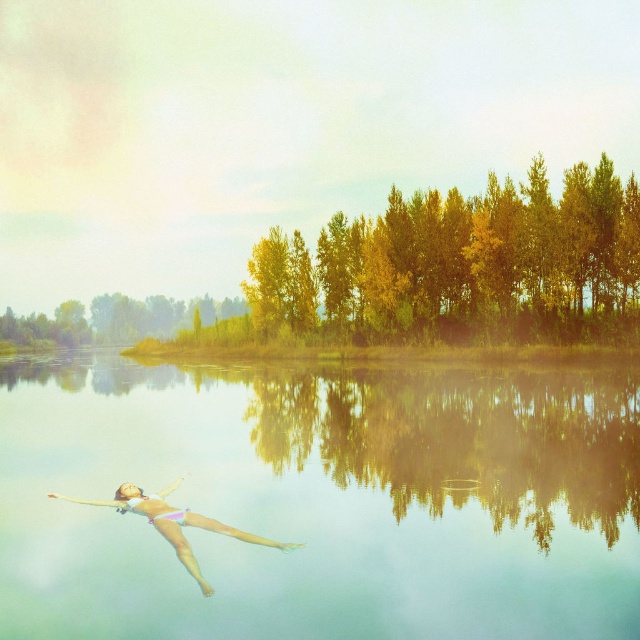
Question: Which point is closer to the camera?

Choices:
 (A) clear water at center
 (B) pink fabric bikini at lower left

Answer: (A)

Question: Does green leafy trees at center have a smaller size compared to pink fabric bikini at lower left?

Choices:
 (A) yes
 (B) no

Answer: (B)

Question: Among these objects, which one is farthest from the camera?

Choices:
 (A) golden textured trees at upper right
 (B) green leafy trees at center
 (C) pink fabric bikini at lower left

Answer: (B)

Question: Which of the following is the closest to the observer?

Choices:
 (A) golden textured trees at upper right
 (B) clear water at center
 (C) pink fabric bikini at lower left

Answer: (B)

Question: Does clear water at center appear under pink fabric bikini at lower left?

Choices:
 (A) yes
 (B) no

Answer: (A)

Question: Is golden textured trees at upper right closer to camera compared to pink fabric bikini at lower left?

Choices:
 (A) no
 (B) yes

Answer: (A)